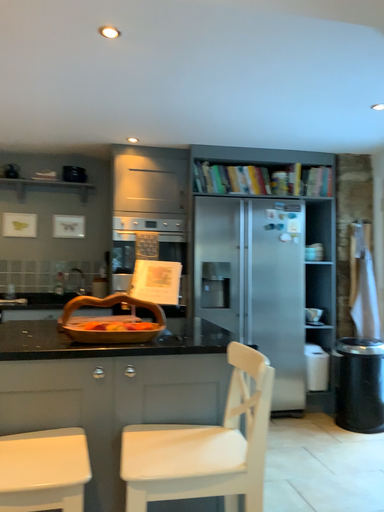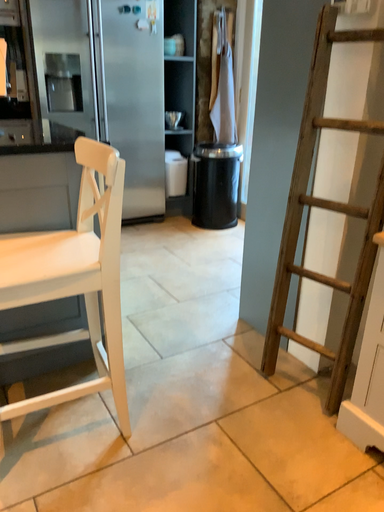
Question: How did the camera likely rotate when shooting the video?

Choices:
 (A) rotated downward
 (B) rotated upward

Answer: (A)